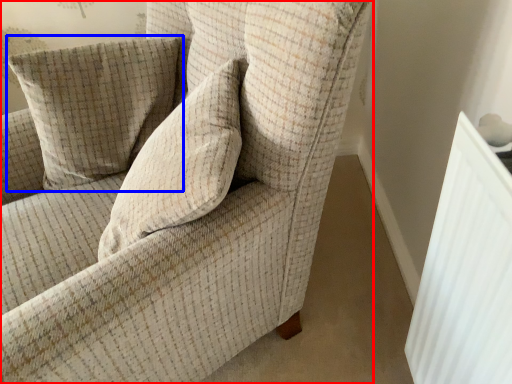
Question: Which object appears closest to the camera in this image, chair (highlighted by a red box) or pillow (highlighted by a blue box)?

Choices:
 (A) chair
 (B) pillow

Answer: (A)